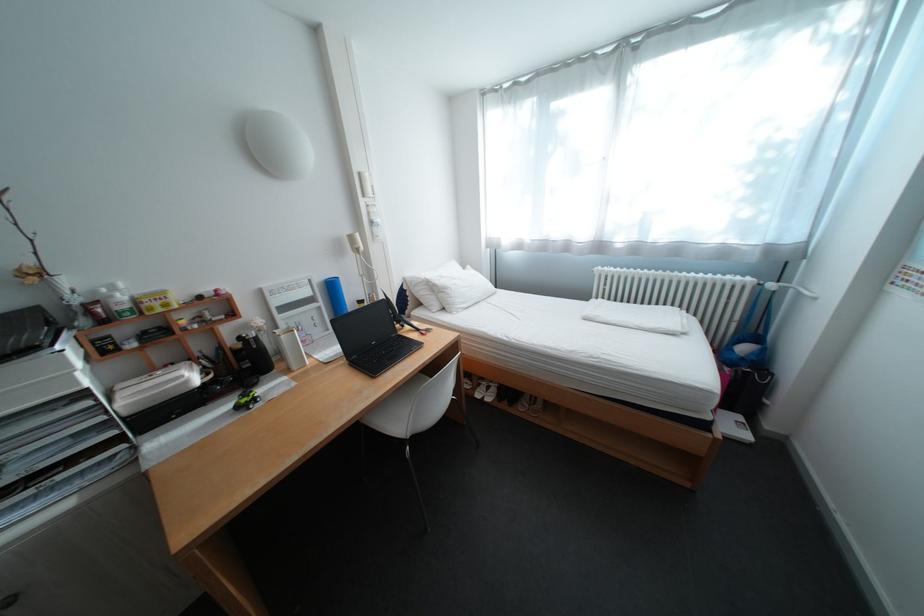
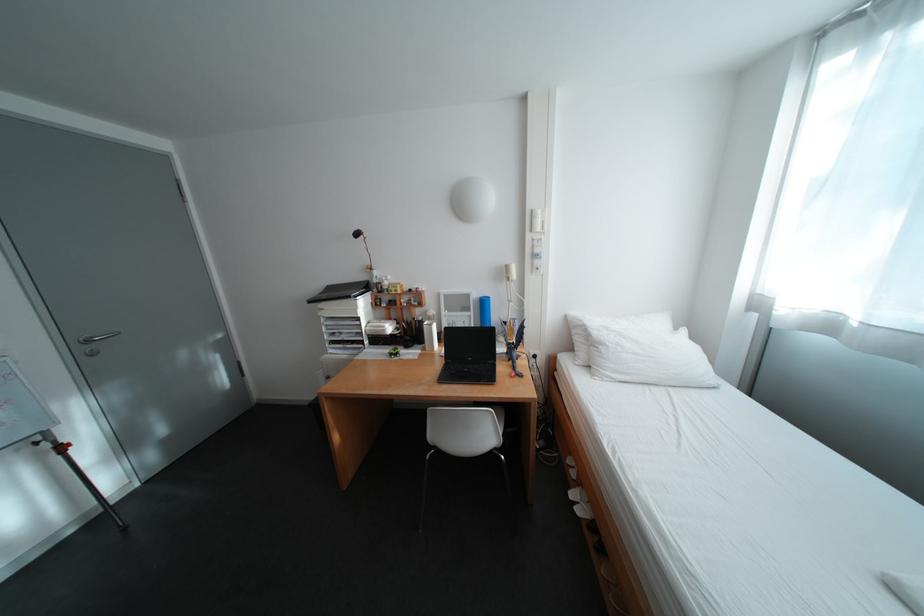
The point at (266, 347) is marked in the first image. Where is the corresponding point in the second image?

(430, 326)